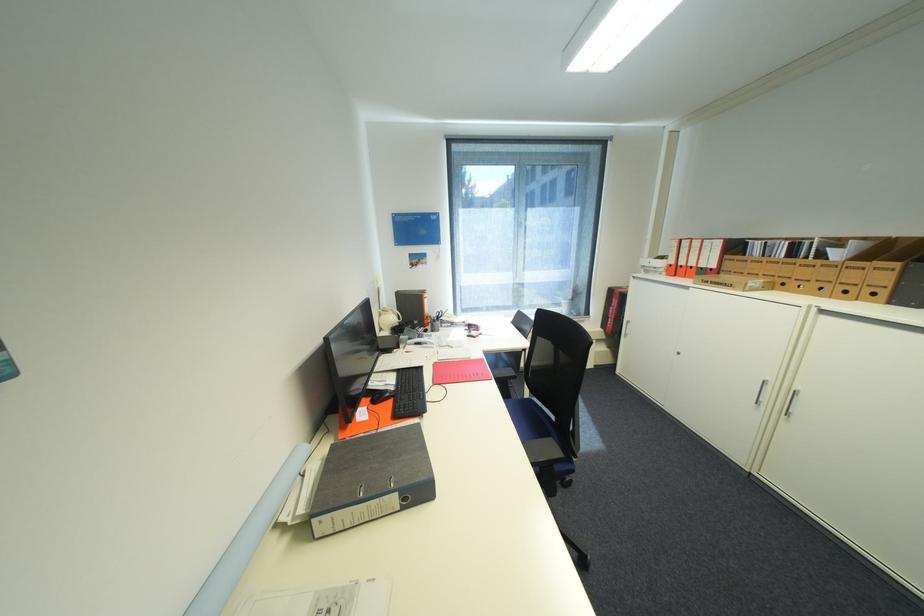
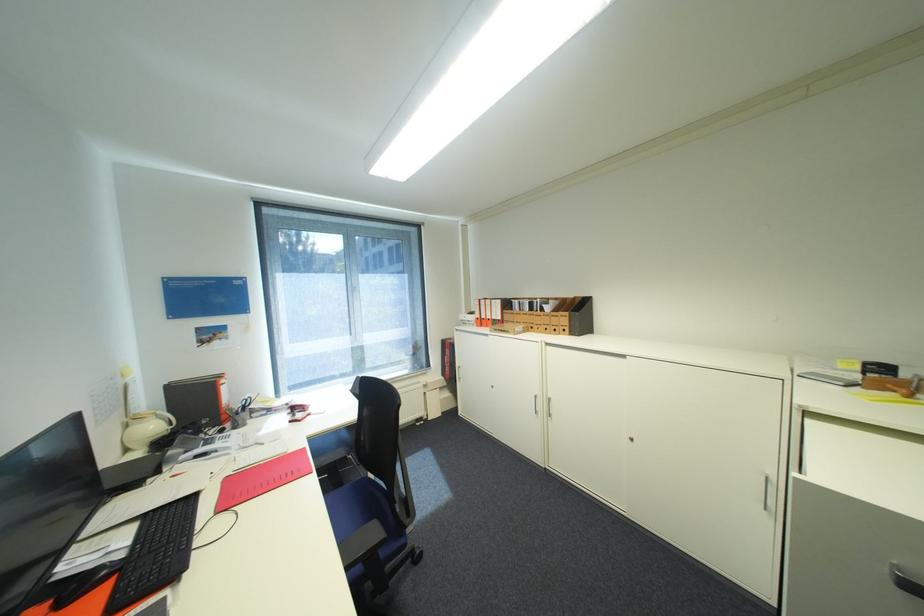
The point at (x=678, y=265) is marked in the first image. Where is the corresponding point in the second image?

(485, 318)